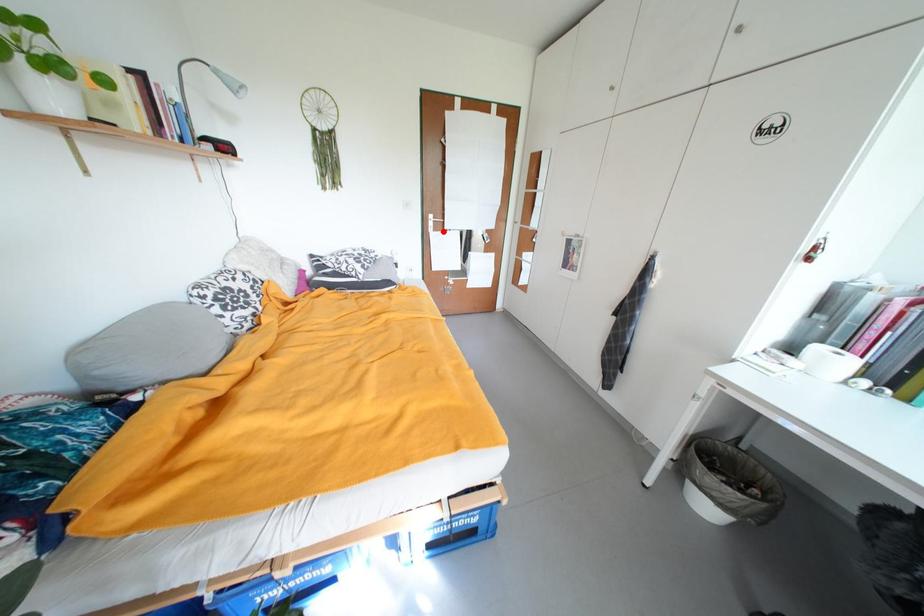
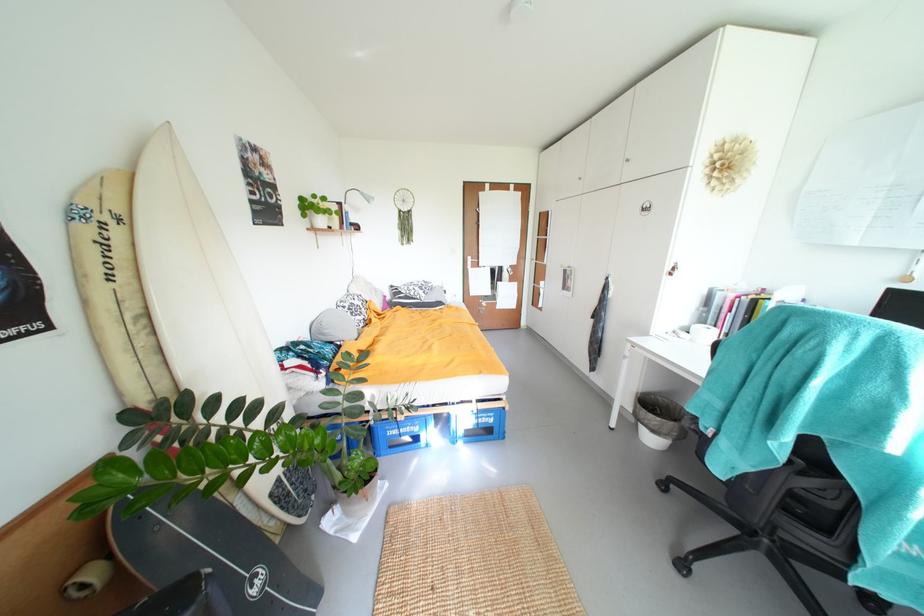
The point at the highlighted location is marked in the first image. Where is the corresponding point in the second image?

(480, 268)